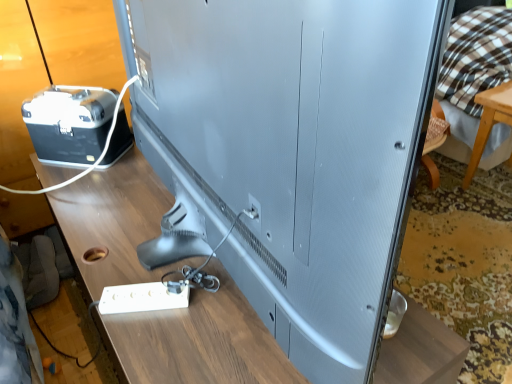
Find the location of a particular element. The height and width of the screenshot is (384, 512). brown checkered fabric at upper right is located at coordinates (472, 71).

This screenshot has width=512, height=384. Describe the element at coordinates (96, 160) in the screenshot. I see `white plastic wire at left` at that location.

Where is `wooden table at center`? The width and height of the screenshot is (512, 384). wooden table at center is located at coordinates (198, 342).

The height and width of the screenshot is (384, 512). Find the location of `brown checkered fabric at upper right`. brown checkered fabric at upper right is located at coordinates (472, 71).

Is point (150, 363) positioned behind point (66, 181)?

No, it is not.

Can white plastic wire at left be found inside wooden table at center?

No, white plastic wire at left is not a part of wooden table at center.

Is wooden table at center closer to the viewer compared to white plastic wire at left?

That is True.

Is wooden table at center oriented away from white plastic wire at left?

No, white plastic wire at left is not at the back of wooden table at center.

From the picture: From the image's perspective, is brown checkered fabric at upper right above white plastic wire at left?

Yes, from the image's perspective, brown checkered fabric at upper right is on top of white plastic wire at left.

Considering the relative sizes of brown checkered fabric at upper right and white plastic wire at left in the image provided, is brown checkered fabric at upper right taller than white plastic wire at left?

Yes, brown checkered fabric at upper right is taller than white plastic wire at left.

Considering the sizes of brown checkered fabric at upper right and white plastic wire at left in the image, is brown checkered fabric at upper right wider or thinner than white plastic wire at left?

brown checkered fabric at upper right is wider than white plastic wire at left.

Is the position of brown checkered fabric at upper right less distant than that of white plastic wire at left?

No.

Does point (51, 187) appear closer or farther from the camera than point (450, 67)?

Point (51, 187) is positioned closer to the camera compared to point (450, 67).

In the image, is white plastic wire at left positioned in front of or behind brown checkered fabric at upper right?

Clearly, white plastic wire at left is in front of brown checkered fabric at upper right.

Is white plastic wire at left not near brown checkered fabric at upper right?

Indeed, white plastic wire at left is not near brown checkered fabric at upper right.

Considering the sizes of objects white plastic wire at left and brown checkered fabric at upper right in the image provided, who is bigger, white plastic wire at left or brown checkered fabric at upper right?

brown checkered fabric at upper right is bigger.

Does brown checkered fabric at upper right turn towards wooden table at center?

Yes, brown checkered fabric at upper right is facing wooden table at center.

From a real-world perspective, is brown checkered fabric at upper right physically located above or below wooden table at center?

Answer: From a real-world perspective, brown checkered fabric at upper right is physically above wooden table at center.

Does white plastic wire at left turn towards white plastic extension cord at lower left?

No, white plastic wire at left is not turned towards white plastic extension cord at lower left.

Is white plastic wire at left not within white plastic extension cord at lower left?

That's correct, white plastic wire at left is outside of white plastic extension cord at lower left.

From a real-world perspective, is white plastic wire at left physically below white plastic extension cord at lower left?

Actually, white plastic wire at left is physically above white plastic extension cord at lower left in the real world.

Relative to white plastic extension cord at lower left, is white plastic wire at left in front or behind?

white plastic wire at left is behind white plastic extension cord at lower left.

I want to click on wire on the left of the white plastic extension cord at lower left, so click(96, 160).

Consider the image. Is white plastic extension cord at lower left next to white plastic wire at left?

white plastic extension cord at lower left and white plastic wire at left are clearly separated.

Is white plastic extension cord at lower left thinner than white plastic wire at left?

Yes.

From a real-world perspective, is white plastic extension cord at lower left located higher than white plastic wire at left?

No, from a real-world perspective, white plastic extension cord at lower left is not over white plastic wire at left

From the image's perspective, which one is positioned higher, wooden table at center or brown checkered fabric at upper right?

brown checkered fabric at upper right, from the image's perspective.

Considering the relative positions of wooden table at center and brown checkered fabric at upper right in the image provided, is wooden table at center to the left of brown checkered fabric at upper right from the viewer's perspective?

Indeed, wooden table at center is positioned on the left side of brown checkered fabric at upper right.

Are wooden table at center and brown checkered fabric at upper right making contact?

No, wooden table at center is not with brown checkered fabric at upper right.

At what (x,y) coordinates should I click in order to perform the action: click on wire that appears above the wooden table at center (from a real-world perspective). Please return your answer as a coordinate pair (x, y). This screenshot has width=512, height=384. Looking at the image, I should click on click(x=96, y=160).

The image size is (512, 384). What are the coordinates of `wire below the brown checkered fabric at upper right (from the image's perspective)` in the screenshot? It's located at (96, 160).

From the image, which object appears to be farther from brown checkered fabric at upper right, white plastic wire at left or wooden table at center?

white plastic wire at left is positioned further to the anchor brown checkered fabric at upper right.

Based on their spatial positions, is white plastic wire at left or brown checkered fabric at upper right closer to wooden table at center?

white plastic wire at left.

Consider the image. Estimate the real-world distances between objects in this image. Which object is closer to white plastic extension cord at lower left, wooden table at center or white plastic wire at left?

Based on the image, wooden table at center appears to be nearer to white plastic extension cord at lower left.

Based on their spatial positions, is brown checkered fabric at upper right or white plastic extension cord at lower left closer to wooden table at center?

The object closer to wooden table at center is white plastic extension cord at lower left.

From the image, which object appears to be farther from wooden table at center, brown checkered fabric at upper right or white plastic wire at left?

brown checkered fabric at upper right is further to wooden table at center.

Estimate the real-world distances between objects in this image. Which object is closer to brown checkered fabric at upper right, white plastic extension cord at lower left or white plastic wire at left?

Based on the image, white plastic wire at left appears to be nearer to brown checkered fabric at upper right.

Estimate the real-world distances between objects in this image. Which object is closer to white plastic wire at left, white plastic extension cord at lower left or brown checkered fabric at upper right?

Among the two, white plastic extension cord at lower left is located nearer to white plastic wire at left.

Which object lies nearer to the anchor point brown checkered fabric at upper right, wooden table at center or white plastic extension cord at lower left?

wooden table at center lies closer to brown checkered fabric at upper right than the other object.

Locate an element on the screen. This screenshot has height=384, width=512. table between white plastic extension cord at lower left and brown checkered fabric at upper right from left to right is located at coordinates (198, 342).

Locate an element on the screen. extension cord situated between white plastic wire at left and brown checkered fabric at upper right from left to right is located at coordinates (144, 297).

The height and width of the screenshot is (384, 512). In order to click on table situated between white plastic wire at left and brown checkered fabric at upper right from left to right in this screenshot , I will do coord(198,342).

Find the location of `extension cord located between wooden table at center and white plastic wire at left in the depth direction`. extension cord located between wooden table at center and white plastic wire at left in the depth direction is located at coordinates (144, 297).